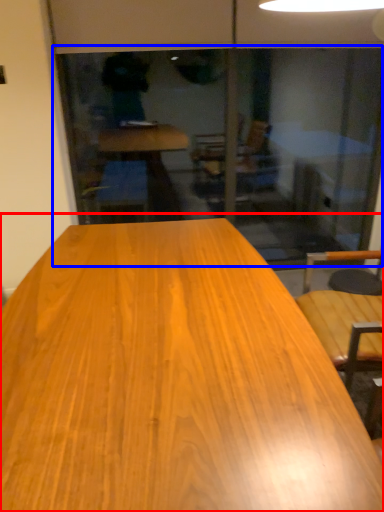
Question: Which object appears farthest to the camera in this image, table (highlighted by a red box) or screen door (highlighted by a blue box)?

Choices:
 (A) table
 (B) screen door

Answer: (B)